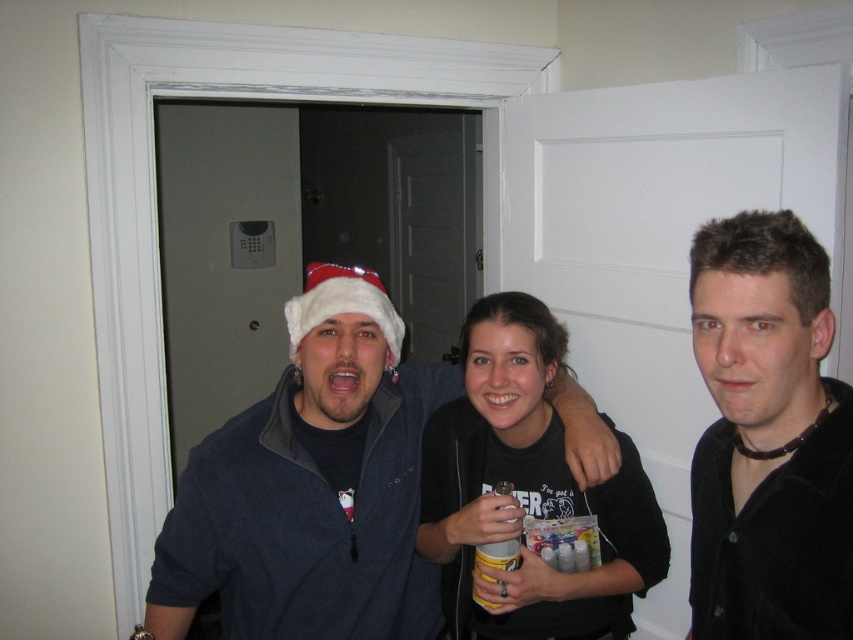
Question: Which is nearer to the black matte shirt at center?

Choices:
 (A) dark blue fleece jacket at center
 (B) black velvet shirt at center

Answer: (A)

Question: Can you confirm if dark blue fleece jacket at center is positioned to the left of black velvet shirt at center?

Choices:
 (A) yes
 (B) no

Answer: (A)

Question: Among these objects, which one is farthest from the camera?

Choices:
 (A) black matte shirt at center
 (B) black velvet shirt at center
 (C) dark blue fleece jacket at center

Answer: (C)

Question: Is dark blue fleece jacket at center behind black matte shirt at center?

Choices:
 (A) yes
 (B) no

Answer: (A)

Question: Which point is closer to the camera?

Choices:
 (A) (491, 481)
 (B) (740, 253)

Answer: (B)

Question: Can you confirm if dark blue fleece jacket at center is smaller than black velvet shirt at center?

Choices:
 (A) no
 (B) yes

Answer: (A)